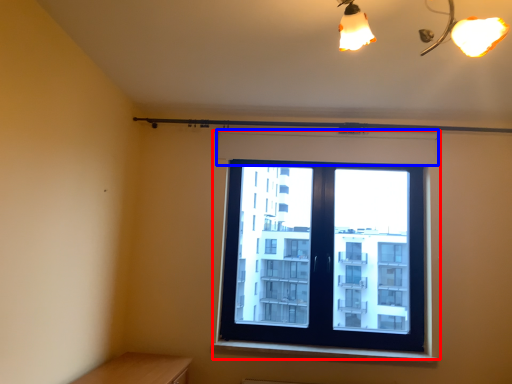
Question: Which point is closer to the camera, window (highlighted by a red box) or shutter (highlighted by a blue box)?

Choices:
 (A) window
 (B) shutter

Answer: (A)